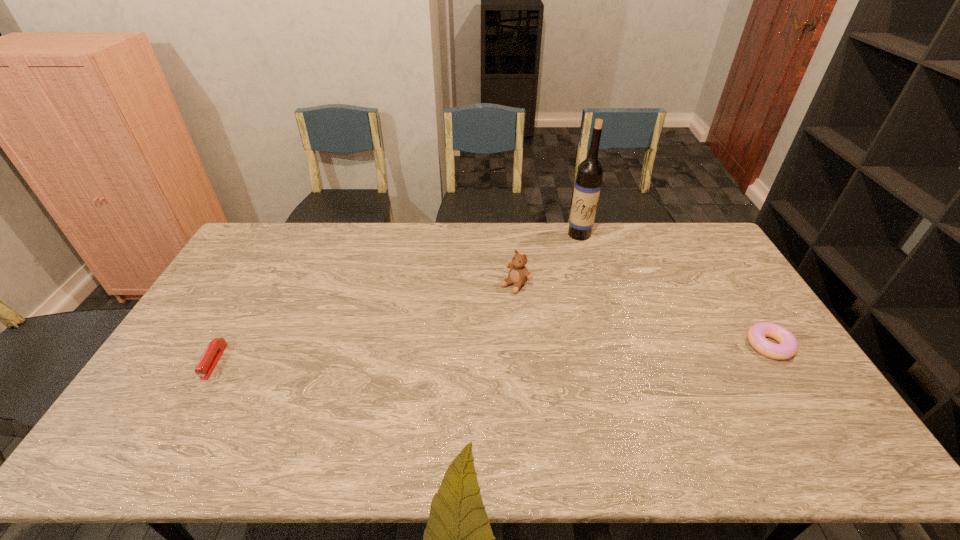
This screenshot has width=960, height=540. What are the coordinates of `free space at the right edge of the desktop` in the screenshot? It's located at (729, 288).

At what (x,y) coordinates should I click in order to perform the action: click on blank space at the far left corner of the desktop. Please return your answer as a coordinate pair (x, y). Image resolution: width=960 pixels, height=540 pixels. Looking at the image, I should click on (261, 227).

Where is `vacant space at the near right corner of the desktop`? This screenshot has height=540, width=960. vacant space at the near right corner of the desktop is located at coordinates (825, 411).

At what (x,y) coordinates should I click in order to perform the action: click on free spot between the farthest object and the third object from right to left. Please return your answer as a coordinate pair (x, y). Image resolution: width=960 pixels, height=540 pixels. Looking at the image, I should click on (547, 259).

Locate an element on the screen. free space between the rightmost object and the third nearest object is located at coordinates (642, 315).

Identify the location of vacant point located between the stapler and the tallest object. (396, 298).

The width and height of the screenshot is (960, 540). In order to click on unoccupied area between the second object from left to right and the rightmost object in this screenshot , I will do `click(642, 315)`.

Where is `unoccupied area between the third object from right to left and the tallest object`? unoccupied area between the third object from right to left and the tallest object is located at coordinates (547, 259).

Locate an element on the screen. The width and height of the screenshot is (960, 540). free space between the leftmost object and the wine bottle is located at coordinates (396, 298).

Identify the location of vacant point located between the leftmost object and the second tallest object. click(365, 323).